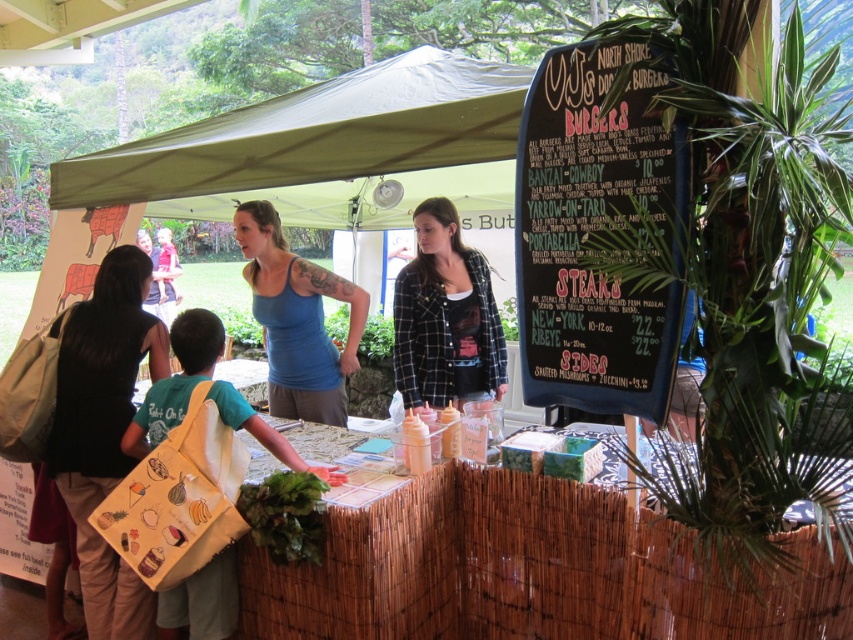
You are at the food stall and need to carry your purchase. You have a black fabric bag at lower left and a yellow fabric bag at center. Which bag can hold more items based on their sizes?

The yellow fabric bag at center can hold more items because its width is greater than the black fabric bag at lower left.

You are a customer at the food stall and need to place your order. You notice a black fabric bag at lower left and a green leafy at lower center. Which item is positioned closer to the front of the stall?

The green leafy at lower center is closer to the front of the stall than the black fabric bag at lower left.

You are standing at the entrance of the food stall and want to read the black chalkboard menu at upper right. Where should you look to see it?

The black chalkboard menu at upper right is located at point (595,234), so you should look towards the upper right area near the bamboo fence to see it.